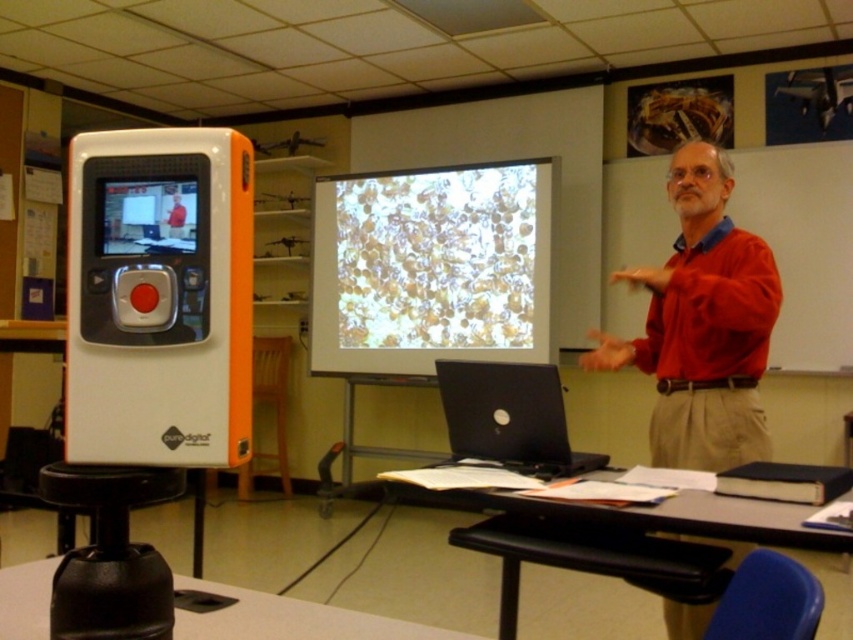
Based on the photo, you are a student sitting in the classroom and want to determine which of the two points, point (672, 452) or point (49, 593), is closer to you. Based on their positions, which point is nearer?

Point (672, 452) is further to the viewer than point (49, 593), so the closer point is point (49, 593).

You are a student who needs to place a 3 feet tall tripod on the smooth black table at lower center so that it can face the white matte projection screen at center. Is there enough space between the table and the screen for the tripod to extend its legs fully and stand upright?

The distance between the white matte projection screen at center and the smooth black table at lower center is 8.43 feet. Since the tripod is only 3 feet tall, there is sufficient space for it to extend its legs and stand upright without any issues.

You are a student sitting in the classroom and want to know which of the two points, point [430,368] or point [792,486], is closer to you. Can you determine this based on their positions?

Point [430,368] is closer to you than point [792,486] because it is further to the viewer.